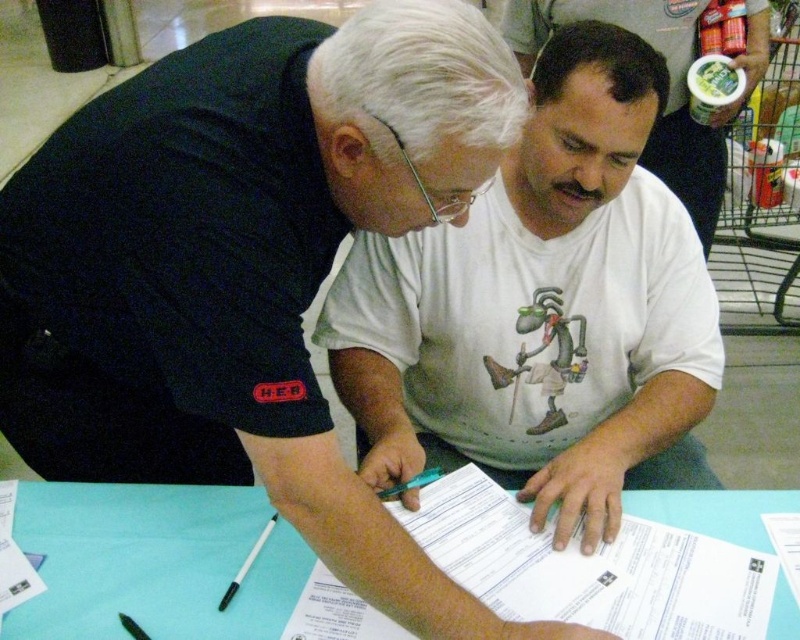
Where is `white cotton shirt at center`? white cotton shirt at center is located at coordinates (544, 310).

Can you confirm if white cotton shirt at center is wider than light blue paper at center?

Correct, the width of white cotton shirt at center exceeds that of light blue paper at center.

Is point (344, 268) positioned before point (120, 508)?

No, it is not.

Find the location of a particular element. white cotton shirt at center is located at coordinates (544, 310).

Which is in front, point (180, 586) or point (244, 566)?

Point (180, 586) is more forward.

Is point (218, 520) farther from camera compared to point (258, 541)?

Yes, point (218, 520) is behind point (258, 541).

Locate an element on the screen. light blue paper at center is located at coordinates (154, 563).

Which is behind, point (670, 56) or point (266, 532)?

The point (670, 56) is behind.

Based on the photo, does white t-shirt at center have a larger size compared to black plastic pen at lower center?

Yes.

Which is in front, point (662, 164) or point (226, 604)?

Positioned in front is point (226, 604).

The height and width of the screenshot is (640, 800). Identify the location of white t-shirt at center. (668, 93).